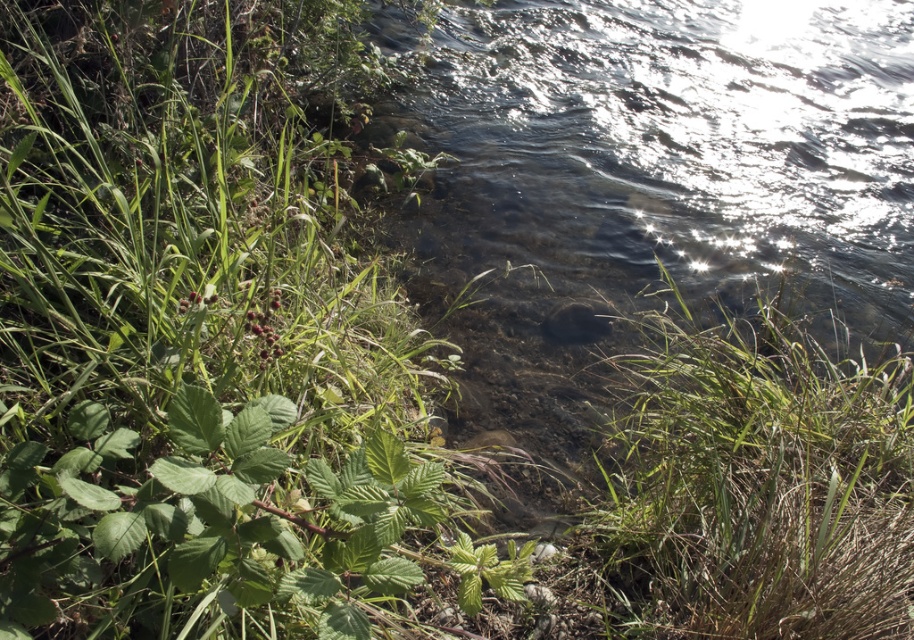
Who is more forward, (206, 465) or (785, 632)?

Positioned in front is point (206, 465).

Describe the element at coordinates (205, 346) in the screenshot. I see `green leafy plant at left` at that location.

Locate an element on the screen. This screenshot has height=640, width=914. green leafy plant at left is located at coordinates (205, 346).